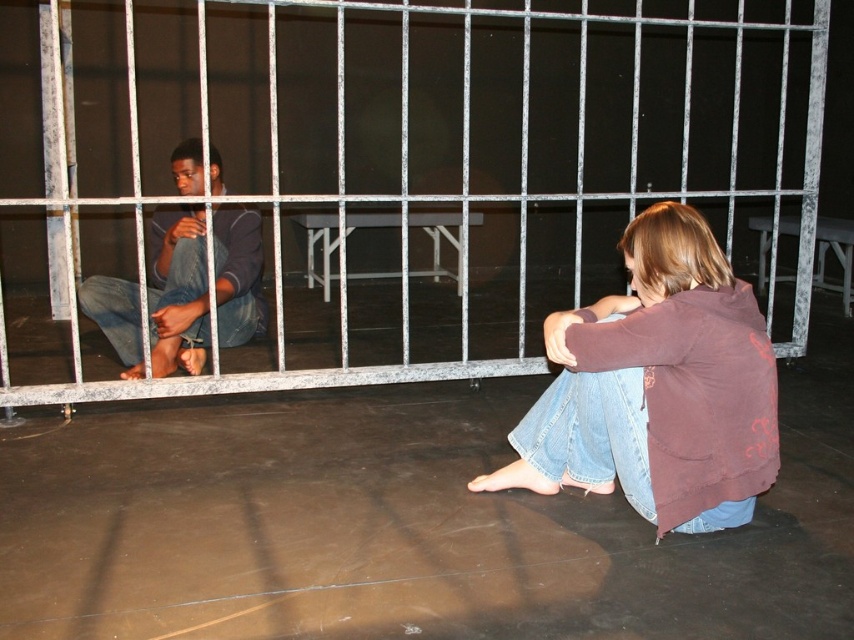
Question: Among these points, which one is nearest to the camera?

Choices:
 (A) (171, 337)
 (B) (439, 145)
 (C) (753, 340)

Answer: (C)

Question: Based on their relative distances, which object is nearer to the brown cotton hoodie at lower right?

Choices:
 (A) dark blue jeans at left
 (B) metallic silver cage at center

Answer: (A)

Question: Which point is farther from the camera taking this photo?

Choices:
 (A) (752, 108)
 (B) (110, 298)

Answer: (A)

Question: Where is metallic silver cage at center located in relation to brown cotton hoodie at lower right in the image?

Choices:
 (A) below
 (B) above

Answer: (B)

Question: Is brown cotton hoodie at lower right above dark blue jeans at left?

Choices:
 (A) yes
 (B) no

Answer: (B)

Question: Is metallic silver cage at center to the left of brown cotton hoodie at lower right from the viewer's perspective?

Choices:
 (A) yes
 (B) no

Answer: (B)